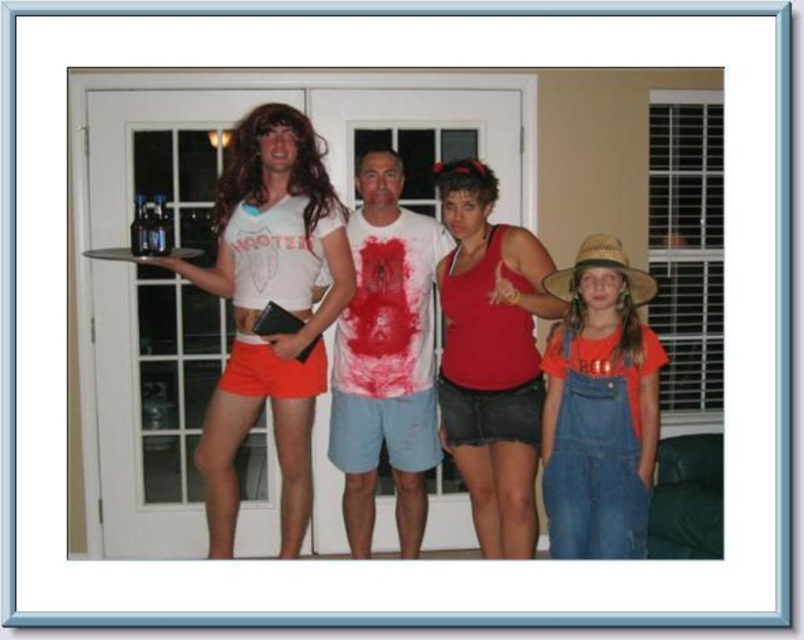
Question: Does matte white t-shirt at left appear over white cotton t-shirt at center?

Choices:
 (A) yes
 (B) no

Answer: (A)

Question: Which point appears closest to the camera in this image?

Choices:
 (A) (378, 401)
 (B) (257, 134)
 (C) (650, 387)

Answer: (C)

Question: Which point is closer to the camera?

Choices:
 (A) matte white t-shirt at left
 (B) denim overalls at right

Answer: (B)

Question: Considering the real-world distances, which object is farthest from the red matte tank top at center?

Choices:
 (A) denim overalls at right
 (B) white cotton t-shirt at center
 (C) matte white t-shirt at left

Answer: (C)

Question: Does matte white t-shirt at left have a greater width compared to red matte tank top at center?

Choices:
 (A) yes
 (B) no

Answer: (A)

Question: Can you confirm if matte white t-shirt at left is positioned to the right of white cotton t-shirt at center?

Choices:
 (A) no
 (B) yes

Answer: (A)